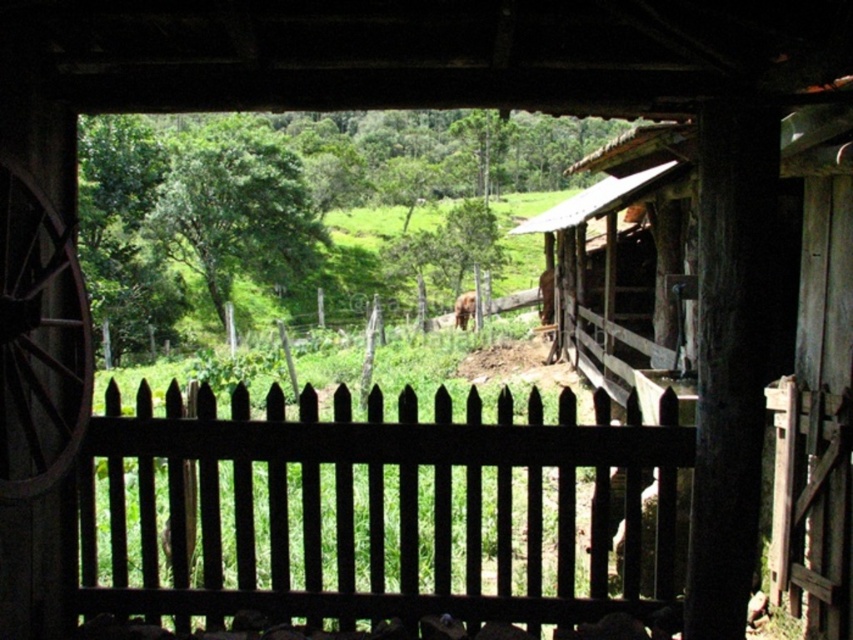
Question: Which object is positioned closest to the brown fur at center?

Choices:
 (A) brown furry horse at center
 (B) rustic wood wagon wheel at left
 (C) black wooden fence at center

Answer: (A)

Question: Is rustic wood wagon wheel at left positioned at the back of brown furry horse at center?

Choices:
 (A) yes
 (B) no

Answer: (B)

Question: Where is brown furry horse at center located in relation to brown fur at center in the image?

Choices:
 (A) above
 (B) below

Answer: (A)

Question: Is rustic wood wagon wheel at left positioned at the back of brown furry horse at center?

Choices:
 (A) yes
 (B) no

Answer: (B)

Question: Which point is farther to the camera?

Choices:
 (A) brown furry horse at center
 (B) brown fur at center

Answer: (B)

Question: Which object is farther from the camera taking this photo?

Choices:
 (A) rustic wood wagon wheel at left
 (B) brown furry horse at center

Answer: (B)